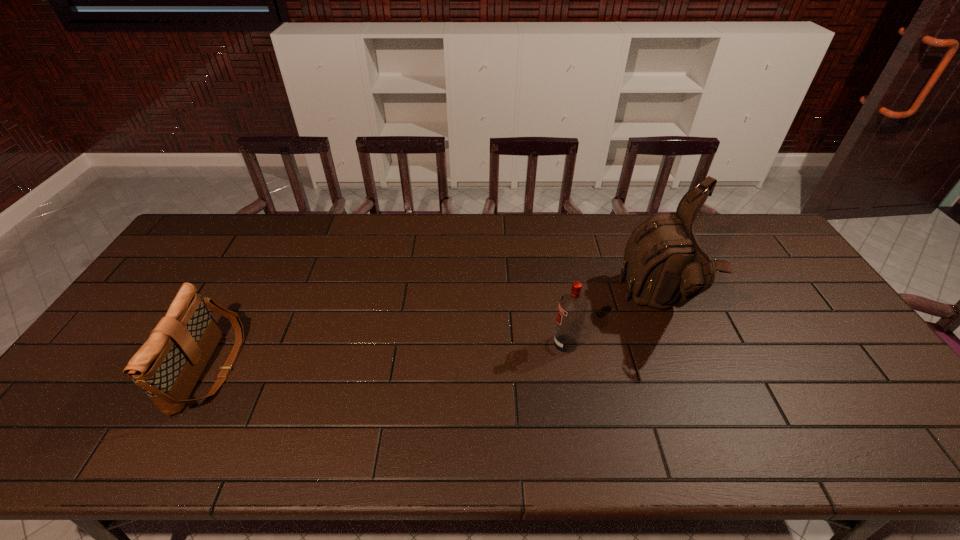
Where is `free spot between the vodka and the taller shoulder bag`? free spot between the vodka and the taller shoulder bag is located at coordinates (612, 324).

Where is `vacant space in between the second object from right to left and the leftmost object`? This screenshot has width=960, height=540. vacant space in between the second object from right to left and the leftmost object is located at coordinates (388, 356).

This screenshot has width=960, height=540. Identify the location of unoccupied position between the taller shoulder bag and the leftmost object. (434, 337).

Find the location of a particular element. This screenshot has height=540, width=960. vacant region between the second object from left to right and the leftmost object is located at coordinates (388, 356).

Identify the location of vacant area between the second object from right to left and the rightmost object. (612, 324).

The image size is (960, 540). Identify the location of unoccupied area between the second object from left to right and the left shoulder bag. (388, 356).

Where is `vacant area between the vodka and the tallest object`? This screenshot has height=540, width=960. vacant area between the vodka and the tallest object is located at coordinates (612, 324).

Identify the location of free space between the shorter shoulder bag and the right shoulder bag. (434, 337).

Choose which object is the nearest neighbor to the leftmost object. Please provide its 2D coordinates. Your answer should be formatted as a tuple, i.e. [(x, y)], where the tuple contains the x and y coordinates of a point satisfying the conditions above.

[(572, 308)]

Locate which object is the closest to the right shoulder bag. Please provide its 2D coordinates. Your answer should be formatted as a tuple, i.e. [(x, y)], where the tuple contains the x and y coordinates of a point satisfying the conditions above.

[(572, 308)]